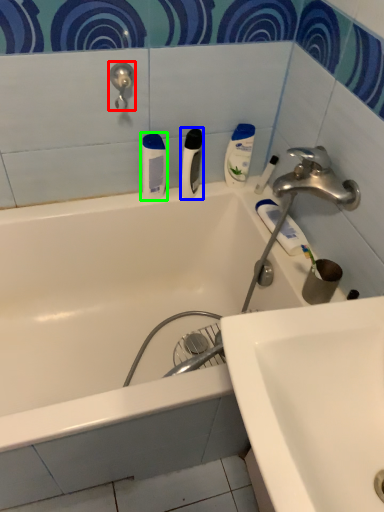
Question: Considering the real-world distances, which object is farthest from shower (highlighted by a red box)? toiletry (highlighted by a blue box) or toiletry (highlighted by a green box)?

Choices:
 (A) toiletry
 (B) toiletry

Answer: (A)